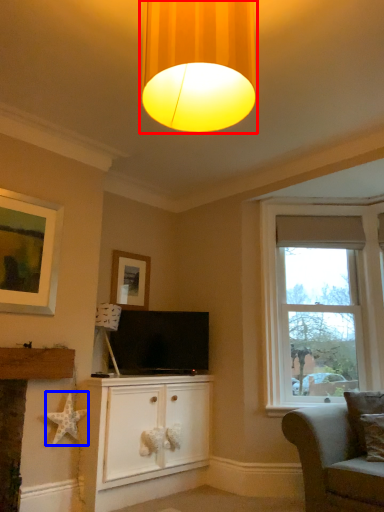
Question: Which object appears farthest to the camera in this image, lamp (highlighted by a red box) or star (highlighted by a blue box)?

Choices:
 (A) lamp
 (B) star

Answer: (B)